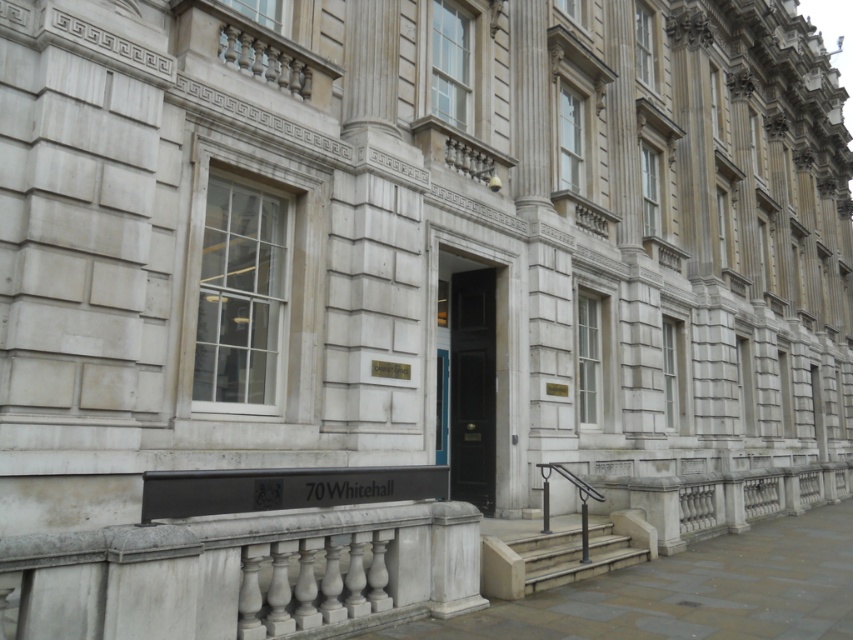
Is black polished wood door at center above smooth concrete stairs at center?

Yes.

Between point (479, 372) and point (496, 557), which one is positioned behind?

Point (479, 372)

At what (x,y) coordinates should I click in order to perform the action: click on black polished wood door at center. Please return your answer as a coordinate pair (x, y). The width and height of the screenshot is (853, 640). Looking at the image, I should click on (473, 387).

Locate an element on the screen. Image resolution: width=853 pixels, height=640 pixels. black polished wood door at center is located at coordinates (473, 387).